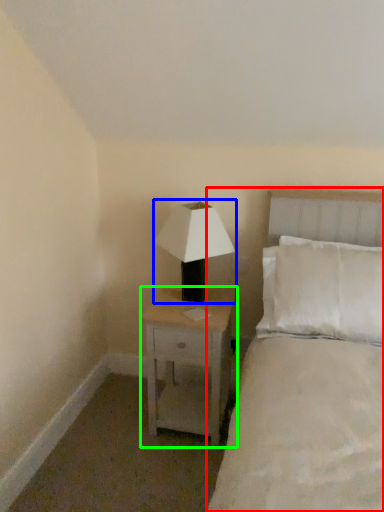
Question: Which is nearer to the bed (highlighted by a red box)? lamp (highlighted by a blue box) or nightstand (highlighted by a green box).

Choices:
 (A) lamp
 (B) nightstand

Answer: (B)